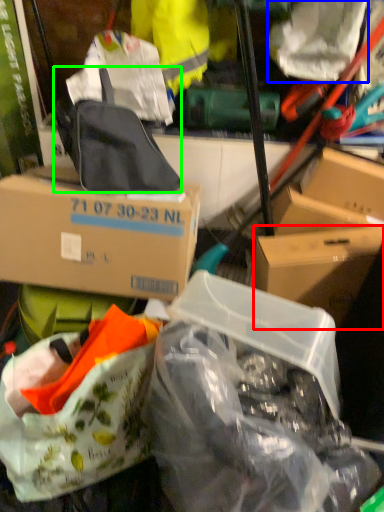
Question: Estimate the real-world distances between objects in this image. Which object is closer to box (highlighted by a red box), plastic bag (highlighted by a blue box) or backpack (highlighted by a green box)?

Choices:
 (A) plastic bag
 (B) backpack

Answer: (B)